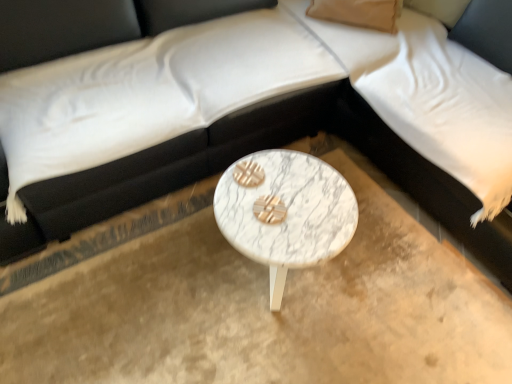
Identify the location of empty space that is ontop of marble/whiteobject at center. (286, 207).